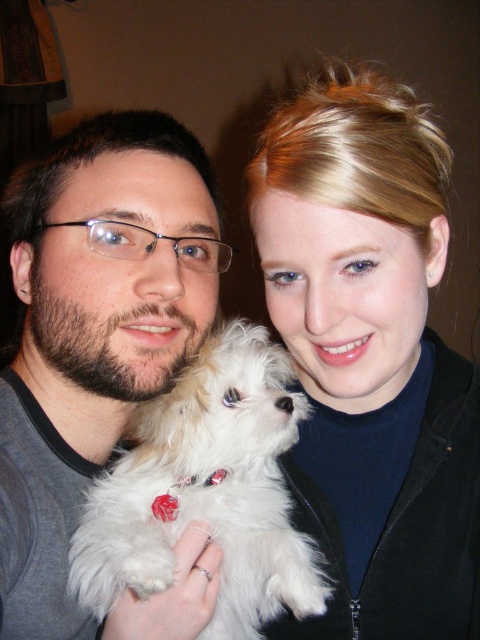
Who is taller, matte white dog at upper right or matte gray shirt at center?

matte white dog at upper right

Can you confirm if matte white dog at upper right is smaller than matte gray shirt at center?

Indeed, matte white dog at upper right has a smaller size compared to matte gray shirt at center.

Where is `matte white dog at upper right`? Image resolution: width=480 pixels, height=640 pixels. matte white dog at upper right is located at coordinates (371, 356).

Can you confirm if matte white dog at upper right is shorter than white fluffy dog at center?

In fact, matte white dog at upper right may be taller than white fluffy dog at center.

At what (x,y) coordinates should I click in order to perform the action: click on matte white dog at upper right. Please return your answer as a coordinate pair (x, y). The width and height of the screenshot is (480, 640). Looking at the image, I should click on (371, 356).

Does point (7, 480) come behind point (263, 621)?

That is False.

Which of these two, matte gray shirt at center or white fluffy dog at center, stands shorter?

Standing shorter between the two is white fluffy dog at center.

Describe the element at coordinates (94, 330) in the screenshot. Image resolution: width=480 pixels, height=640 pixels. I see `matte gray shirt at center` at that location.

At what (x,y) coordinates should I click in order to perform the action: click on matte gray shirt at center. Please return your answer as a coordinate pair (x, y). The image size is (480, 640). Looking at the image, I should click on (94, 330).